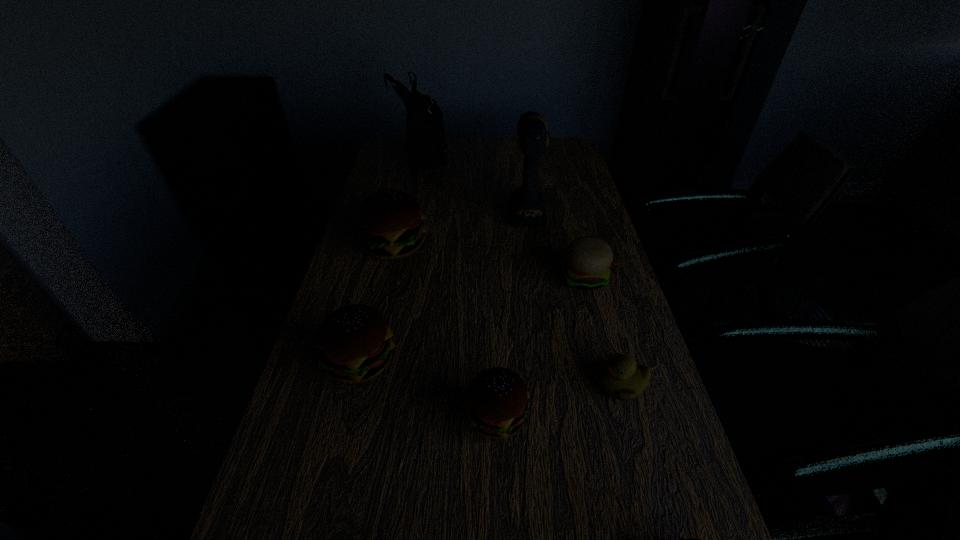
You are a GUI agent. You are given a task and a screenshot of the screen. Output one action in this format:
    pyautogui.click(x=<x>, y=<y>)
    Task: Click on the duckling
    The height and width of the screenshot is (540, 960).
    Given the screenshot: What is the action you would take?
    pyautogui.click(x=621, y=378)

Find the location of a particular element. The height and width of the screenshot is (540, 960). free space located on the front-facing side of the farthest object is located at coordinates (522, 156).

This screenshot has width=960, height=540. Find the location of `blank space located 0.330m with the drill bit of the drill facing forward`. blank space located 0.330m with the drill bit of the drill facing forward is located at coordinates (517, 146).

Where is `free spot located with the drill bit of the drill facing forward`? free spot located with the drill bit of the drill facing forward is located at coordinates (520, 171).

Locate an element on the screen. vacant area situated 0.230m with the drill bit of the drill facing forward is located at coordinates (518, 158).

Locate an element on the screen. The width and height of the screenshot is (960, 540). free space located 0.100m on the back of the tallest hamburger is located at coordinates (403, 210).

At what (x,y) coordinates should I click in order to perform the action: click on vacant space located 0.190m on the back of the fourth shortest hamburger. Please return your answer as a coordinate pair (x, y). The width and height of the screenshot is (960, 540). Looking at the image, I should click on (381, 281).

Where is `free point located on the front of the second brown hamburger from right to left`? The height and width of the screenshot is (540, 960). free point located on the front of the second brown hamburger from right to left is located at coordinates (498, 496).

Where is `free space located on the front of the beige hamburger`? The image size is (960, 540). free space located on the front of the beige hamburger is located at coordinates (600, 338).

I want to click on free space located at the beak of the duckling, so click(x=439, y=384).